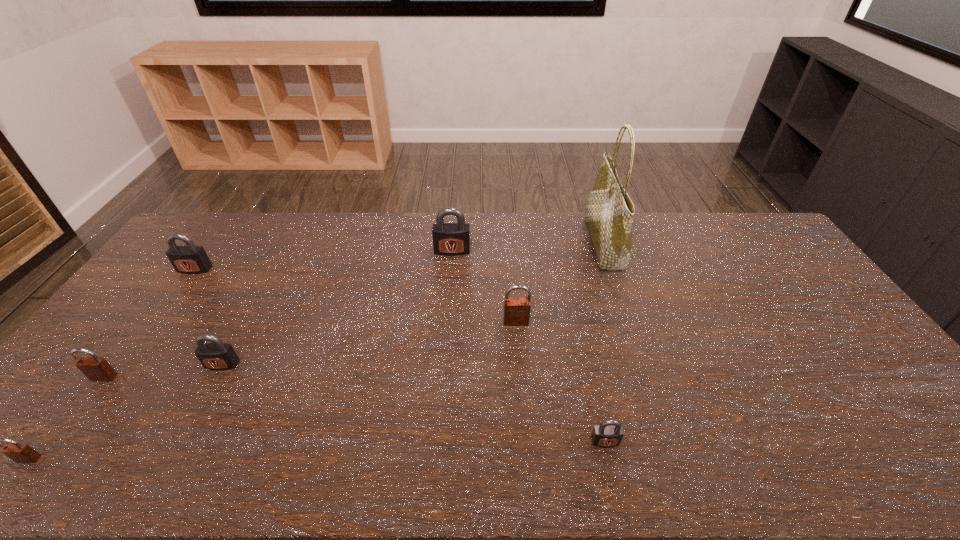
Locate an element on the screen. the fourth nearest object is located at coordinates (217, 355).

The width and height of the screenshot is (960, 540). What are the coordinates of `the fourth padlock from left to right` in the screenshot? It's located at (217, 355).

Locate an element on the screen. This screenshot has height=540, width=960. the second nearest object is located at coordinates (609, 433).

Identify the location of the nearest gray padlock. (609, 433).

The image size is (960, 540). I want to click on the nearest object, so click(20, 453).

Find the location of a particular element. This screenshot has width=960, height=540. the smallest brown padlock is located at coordinates (20, 453).

Find the location of `free location located 0.080m on the left of the tallest object`. free location located 0.080m on the left of the tallest object is located at coordinates (565, 244).

Identify the location of vacant point located 0.290m on the front of the second tallest object near the keyhole. This screenshot has width=960, height=540. (447, 318).

Locate an element on the screen. free location located 0.080m on the front of the third nearest gray padlock near the keyhole is located at coordinates point(179,292).

Find the location of a particular element. This screenshot has height=540, width=960. free space located on the front-facing side of the biggest brown padlock is located at coordinates (524, 426).